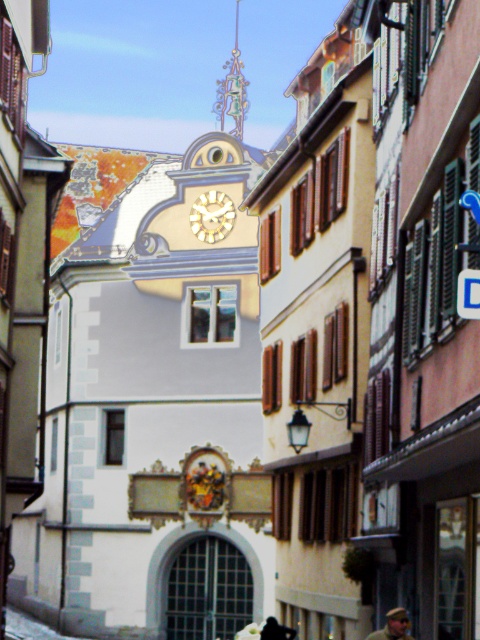
You are standing on the street in front of the historic European town scene. You want to take a photo of the goldmetallicclock at center without any obstructions. Given that the clock is 333.47 feet away from you, is there enough space between you and the clock to move freely while ensuring the entire clock is visible in your photo?

The goldmetallicclock at center is 333.47 feet away from the viewer. This distance should provide ample space to move freely and ensure the entire clock is visible in your photo without obstructions, as there are no mentioned obstacles between you and the clock in the scene description.

You are standing in the historic town square and see the goldmetallicclock at center and the camouflage fabric cap at center. If you want to place a 50 meter long banner between them, will it be long enough?

The distance between the goldmetallicclock at center and the camouflage fabric cap at center is 47.73 meters. Since the banner is 50 meters long, it will be long enough to span the distance between them.